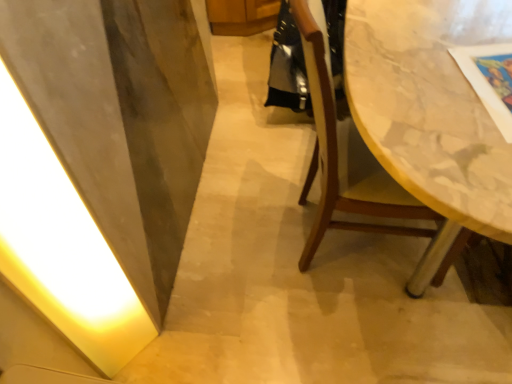
Question: Does shiny black robe at center have a greater height compared to wooden chair at right?

Choices:
 (A) yes
 (B) no

Answer: (B)

Question: From a real-world perspective, is shiny black robe at center physically below wooden chair at right?

Choices:
 (A) yes
 (B) no

Answer: (A)

Question: Is the surface of shiny black robe at center in direct contact with wooden chair at right?

Choices:
 (A) no
 (B) yes

Answer: (A)

Question: Does shiny black robe at center have a lesser width compared to wooden chair at right?

Choices:
 (A) no
 (B) yes

Answer: (B)

Question: Is shiny black robe at center not within wooden chair at right?

Choices:
 (A) no
 (B) yes

Answer: (B)

Question: From the image's perspective, does shiny black robe at center appear lower than wooden chair at right?

Choices:
 (A) no
 (B) yes

Answer: (A)

Question: Considering the relative sizes of wooden chair at right and shiny black robe at center in the image provided, is wooden chair at right taller than shiny black robe at center?

Choices:
 (A) no
 (B) yes

Answer: (B)

Question: Is wooden chair at right directly adjacent to shiny black robe at center?

Choices:
 (A) no
 (B) yes

Answer: (A)

Question: Is wooden chair at right completely or partially outside of shiny black robe at center?

Choices:
 (A) no
 (B) yes

Answer: (B)

Question: Is wooden chair at right smaller than shiny black robe at center?

Choices:
 (A) no
 (B) yes

Answer: (A)

Question: From a real-world perspective, is wooden chair at right over shiny black robe at center?

Choices:
 (A) yes
 (B) no

Answer: (A)

Question: Considering the relative sizes of wooden chair at right and shiny black robe at center in the image provided, is wooden chair at right shorter than shiny black robe at center?

Choices:
 (A) yes
 (B) no

Answer: (B)

Question: Can you confirm if white glossy light at left is smaller than shiny black robe at center?

Choices:
 (A) no
 (B) yes

Answer: (B)